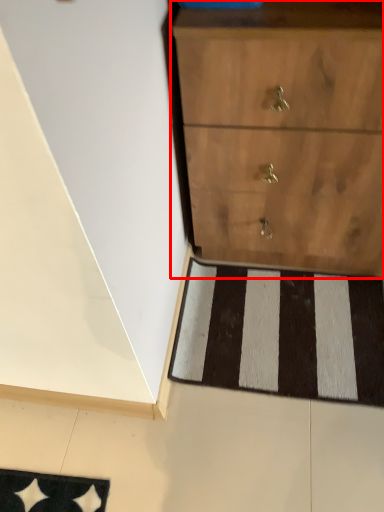
Question: From the image's perspective, what is the correct spatial relationship of chest of drawers (annotated by the red box) in relation to doormat?

Choices:
 (A) above
 (B) below

Answer: (A)